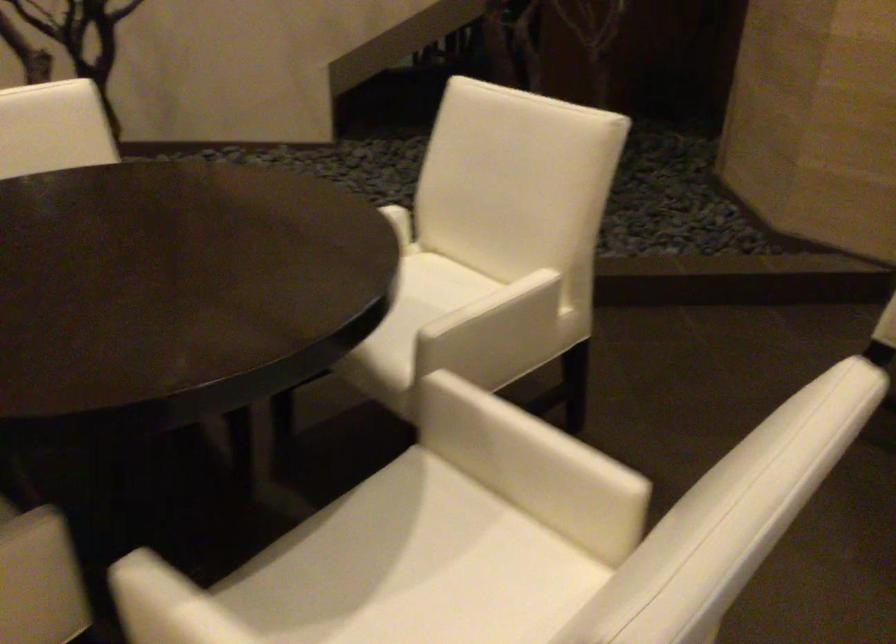
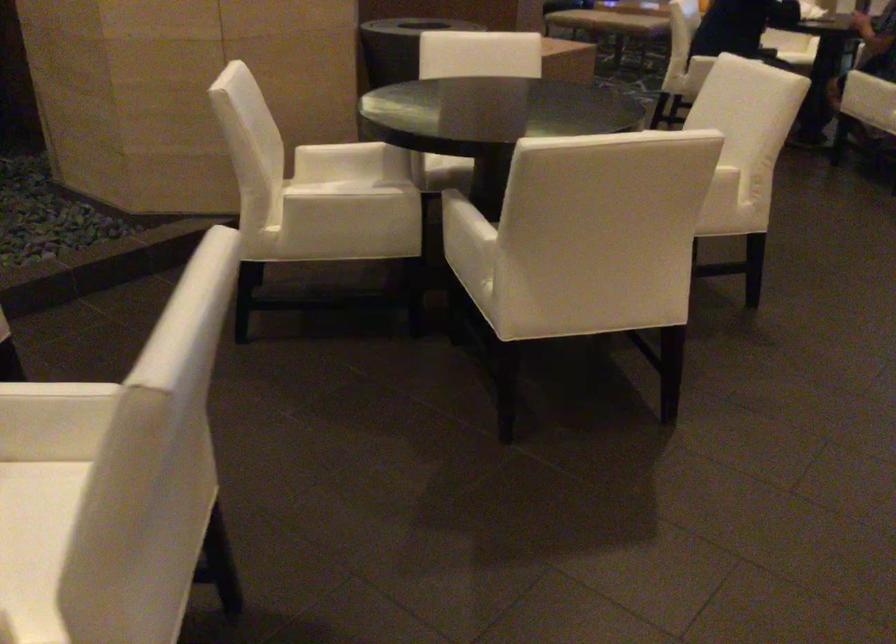
Question: The camera is either moving clockwise (left) or counter-clockwise (right) around the object. The first image is from the beginning of the video and the second image is from the end. Is the camera moving left or right when shooting the video?

Choices:
 (A) Left
 (B) Right

Answer: (A)